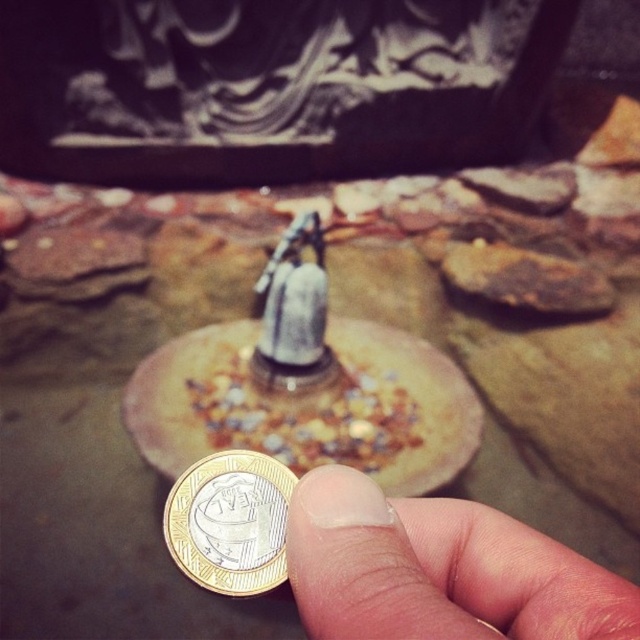
Question: Which point is farther to the camera?

Choices:
 (A) (284, 580)
 (B) (276, 362)

Answer: (B)

Question: Does smooth skin at center come behind silver metallic bell at center?

Choices:
 (A) no
 (B) yes

Answer: (A)

Question: From the image, what is the correct spatial relationship of gold metallic coin at center in relation to silver metallic bell at center?

Choices:
 (A) left
 (B) right

Answer: (B)

Question: Which point is farther to the camera?

Choices:
 (A) (214, 566)
 (B) (292, 243)

Answer: (B)

Question: Among these points, which one is farthest from the camera?

Choices:
 (A) (300, 236)
 (B) (218, 576)
 (C) (477, 540)

Answer: (A)

Question: Can you confirm if gold metallic coin at center is positioned to the left of silver metallic bell at center?

Choices:
 (A) no
 (B) yes

Answer: (A)